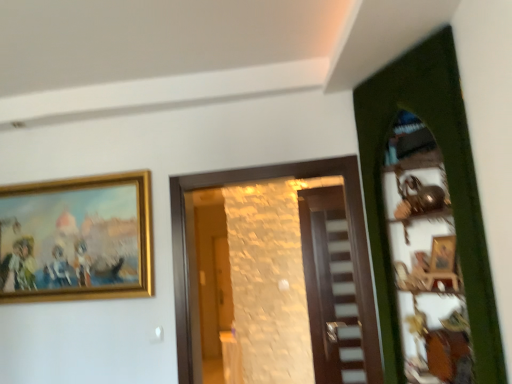
Question: Is matte wooden door at center, which is the 1th door from back to front, positioned in front of green wooden door at right, the third door in the back-to-front sequence?

Choices:
 (A) yes
 (B) no

Answer: (B)

Question: From a real-world perspective, does matte wooden door at center, which is the 1th door from back to front, sit lower than green wooden door at right, the 1th door from the front?

Choices:
 (A) yes
 (B) no

Answer: (A)

Question: Is green wooden door at right, the third door in the back-to-front sequence, completely or partially inside matte wooden door at center, which is the 1th door from back to front?

Choices:
 (A) yes
 (B) no

Answer: (B)

Question: Can we say matte wooden door at center, marked as the third door in a front-to-back arrangement, lies outside green wooden door at right, the third door in the back-to-front sequence?

Choices:
 (A) no
 (B) yes

Answer: (B)

Question: From the image's perspective, is matte wooden door at center, which is the 1th door from back to front, above green wooden door at right, the third door in the back-to-front sequence?

Choices:
 (A) no
 (B) yes

Answer: (A)

Question: Can you confirm if matte wooden door at center, marked as the third door in a front-to-back arrangement, is wider than green wooden door at right, the 1th door from the front?

Choices:
 (A) no
 (B) yes

Answer: (A)

Question: Is wooden door at center, which ranks as the 2th door in back-to-front order, bigger than green wooden door at right, the third door in the back-to-front sequence?

Choices:
 (A) no
 (B) yes

Answer: (A)

Question: Is wooden door at center, which ranks as the second door in front-to-back order, shorter than green wooden door at right, the 1th door from the front?

Choices:
 (A) yes
 (B) no

Answer: (A)

Question: Would you consider wooden door at center, which ranks as the second door in front-to-back order, to be distant from green wooden door at right, the 1th door from the front?

Choices:
 (A) yes
 (B) no

Answer: (B)

Question: From the image's perspective, is wooden door at center, which ranks as the 2th door in back-to-front order, over green wooden door at right, the 1th door from the front?

Choices:
 (A) yes
 (B) no

Answer: (B)

Question: Is wooden door at center, which ranks as the 2th door in back-to-front order, surrounding green wooden door at right, the 1th door from the front?

Choices:
 (A) yes
 (B) no

Answer: (B)

Question: From the image's perspective, would you say wooden door at center, which ranks as the 2th door in back-to-front order, is shown under green wooden door at right, the third door in the back-to-front sequence?

Choices:
 (A) yes
 (B) no

Answer: (A)

Question: Is matte wooden door at center, which is the 1th door from back to front, positioned with its back to wooden door at center, which ranks as the second door in front-to-back order?

Choices:
 (A) yes
 (B) no

Answer: (B)